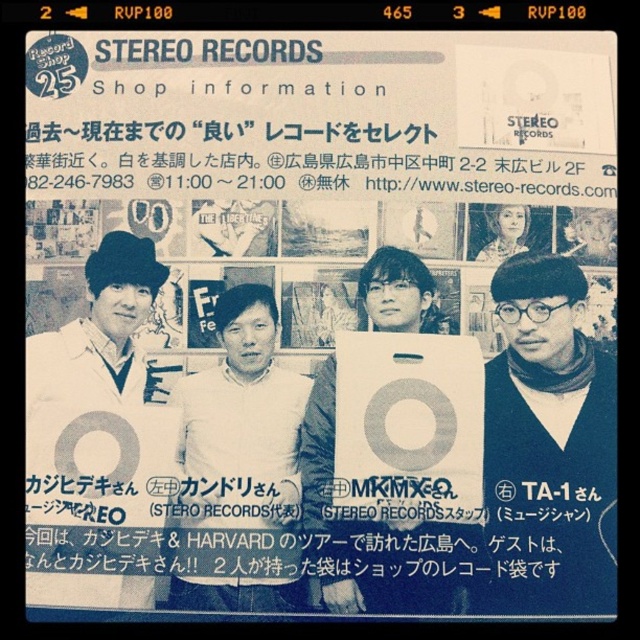
Based on the provided scene description, what object is located at the coordinates point (x=99, y=330)?

The point (x=99, y=330) indicates the white matte hat at upper left.

You are a customer browsing the clothing section of Stereo Records. You see a matte black sweater at right and a white cotton shirt at center. Which item is positioned higher on the rack?

The matte black sweater at right is positioned higher on the rack than the white cotton shirt at center.